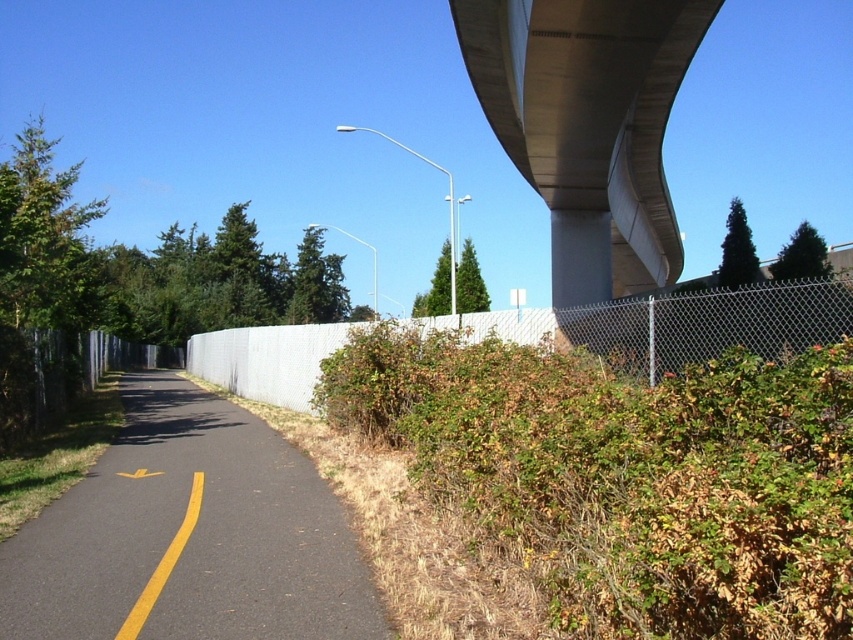
You are standing at the starting point of the path and want to reach the end. There are two points marked on the path, point 1 at coordinates point (7, 630) and point 2 at coordinates point (541, 308). Which point will you encounter first as you walk along the path?

Point 1 at coordinates point (7, 630) will be encountered first because it is closer to the camera, meaning it is nearer to the starting point.

You are a delivery robot with a 5 foot wide package. You are positioned at the camera location and need to place the package on the yellow asphalt highway at lower left. Can you reach the highway without moving your position?

The yellow asphalt highway at lower left is 15.53 feet from camera. Since the robot is at the camera location, it can reach the highway as the distance is sufficient for placement without needing to move.